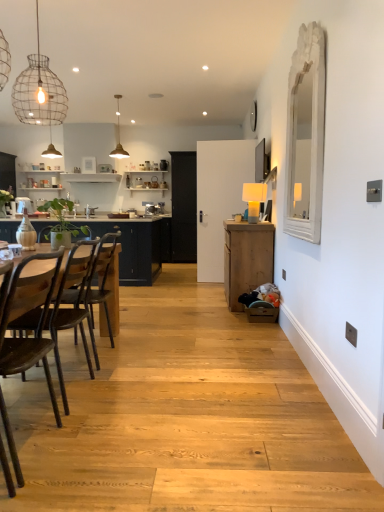
Question: Can you confirm if black glass door at center is thinner than wire mesh light fixture at upper left?

Choices:
 (A) no
 (B) yes

Answer: (A)

Question: From the image's perspective, is black glass door at center under wire mesh light fixture at upper left?

Choices:
 (A) yes
 (B) no

Answer: (A)

Question: Are black glass door at center and wire mesh light fixture at upper left beside each other?

Choices:
 (A) yes
 (B) no

Answer: (B)

Question: Could you tell me if black glass door at center is turned towards wire mesh light fixture at upper left?

Choices:
 (A) yes
 (B) no

Answer: (A)

Question: Considering the relative sizes of black glass door at center and wire mesh light fixture at upper left in the image provided, is black glass door at center taller than wire mesh light fixture at upper left?

Choices:
 (A) yes
 (B) no

Answer: (A)

Question: Choose the correct answer: Is wooden chair at left, arranged as the first chair when viewed from the back, inside blue matte countertop at left or outside it?

Choices:
 (A) outside
 (B) inside

Answer: (A)

Question: Relative to blue matte countertop at left, is wooden chair at left, the 3th chair viewed from the front, in front or behind?

Choices:
 (A) front
 (B) behind

Answer: (A)

Question: From the image's perspective, is wooden chair at left, the 3th chair viewed from the front, positioned above or below blue matte countertop at left?

Choices:
 (A) above
 (B) below

Answer: (B)

Question: From a real-world perspective, is wooden chair at left, the 3th chair viewed from the front, physically located above or below blue matte countertop at left?

Choices:
 (A) above
 (B) below

Answer: (B)

Question: Considering their positions, is wooden cabinet at right located in front of or behind dark brown wood chair at left, the 2th chair from the back?

Choices:
 (A) behind
 (B) front

Answer: (A)

Question: Do you think wooden cabinet at right is within dark brown wood chair at left, which is the 2th chair from front to back, or outside of it?

Choices:
 (A) inside
 (B) outside

Answer: (B)

Question: Looking at the image, does wooden cabinet at right seem bigger or smaller compared to dark brown wood chair at left, the 2th chair from the back?

Choices:
 (A) small
 (B) big

Answer: (B)

Question: Does point (269, 261) appear closer or farther from the camera than point (71, 280)?

Choices:
 (A) closer
 (B) farther

Answer: (B)

Question: Based on their sizes in the image, would you say metallic pendant light at upper center, the 1th lamp from the back, is bigger or smaller than blue matte countertop at left?

Choices:
 (A) big
 (B) small

Answer: (B)

Question: From their relative heights in the image, would you say metallic pendant light at upper center, which is the first lamp from top to bottom, is taller or shorter than blue matte countertop at left?

Choices:
 (A) tall
 (B) short

Answer: (B)